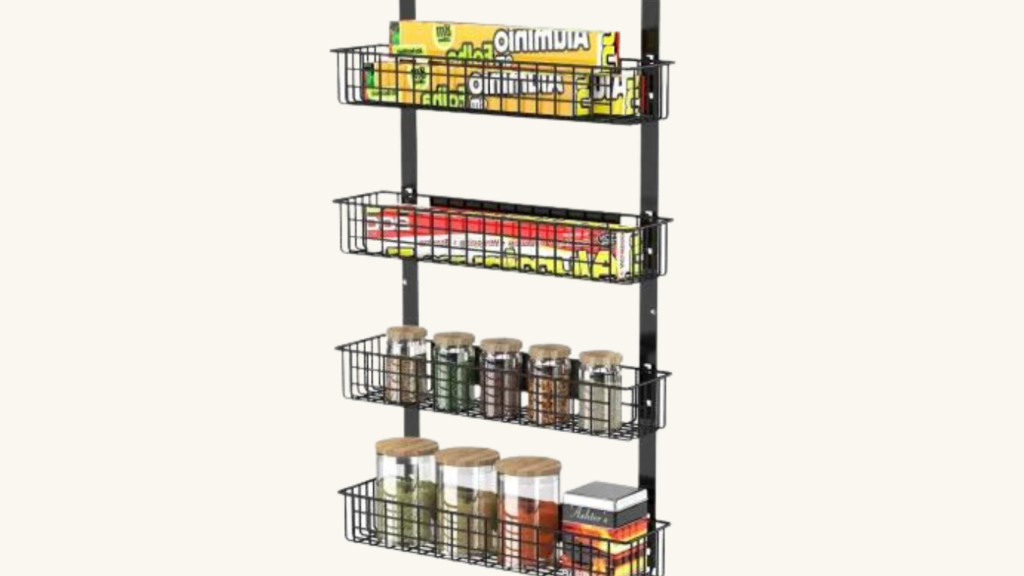
Find the location of a particular element. four shelves is located at coordinates (656, 71), (657, 219), (652, 377), (657, 522).